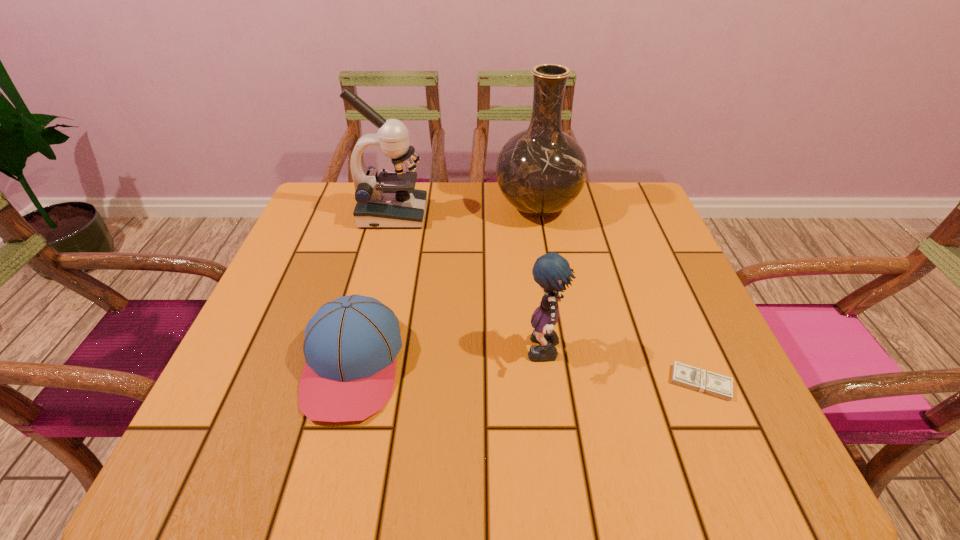
The height and width of the screenshot is (540, 960). What are the coordinates of `vacant space at the far edge of the desktop` in the screenshot? It's located at (493, 206).

Find the location of a particular element. Image resolution: width=960 pixels, height=540 pixels. vacant region at the near edge of the desktop is located at coordinates [308, 447].

Locate an element on the screen. This screenshot has height=540, width=960. vacant space at the left edge of the desktop is located at coordinates (277, 315).

The height and width of the screenshot is (540, 960). In the image, there is a desktop. What are the coordinates of `vacant space at the right edge` in the screenshot? It's located at (645, 341).

In the image, there is a desktop. What are the coordinates of `vacant space at the far left corner` in the screenshot? It's located at (327, 183).

Image resolution: width=960 pixels, height=540 pixels. I want to click on blank space at the near left corner of the desktop, so 271,454.

Locate an element on the screen. vacant area at the far right corner is located at coordinates [x=597, y=194].

This screenshot has height=540, width=960. In the image, there is a desktop. Identify the location of vacant region at the near right corner. (725, 463).

The width and height of the screenshot is (960, 540). What are the coordinates of `unoccupied position between the baseball cap and the third shortest object` in the screenshot? It's located at (448, 360).

You are a GUI agent. You are given a task and a screenshot of the screen. Output one action in this format:
    pyautogui.click(x=<x>, y=<y>)
    Task: Click on the empty space between the third shortest object and the microscope
    Image resolution: width=960 pixels, height=540 pixels.
    Given the screenshot: What is the action you would take?
    pyautogui.click(x=468, y=285)